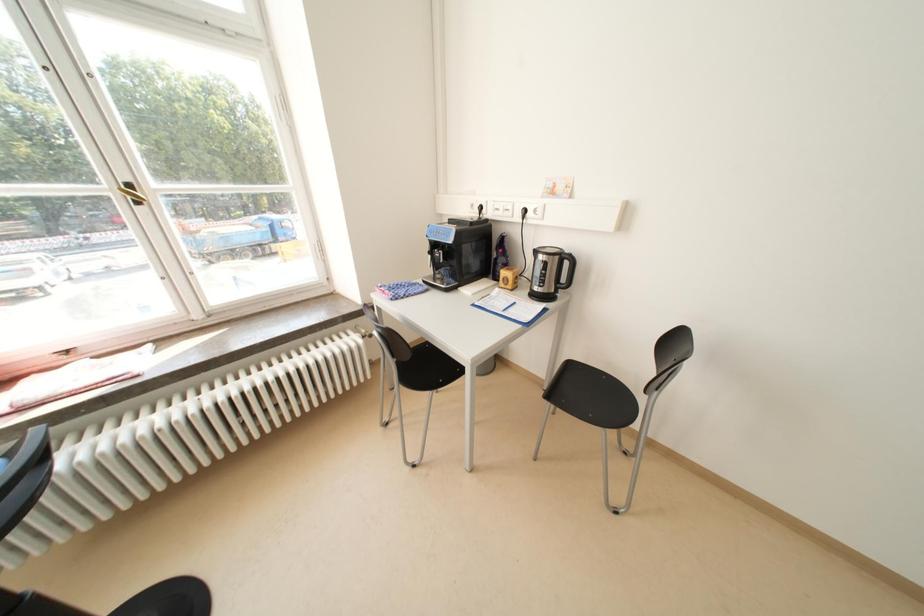
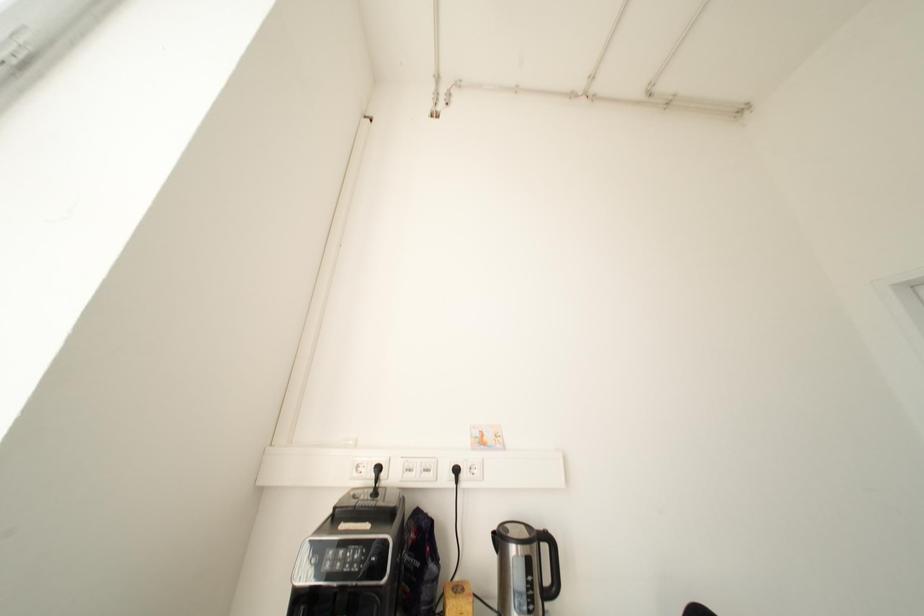
Based on the continuous images, in which direction is the camera rotating?

The camera rotated toward right-up.